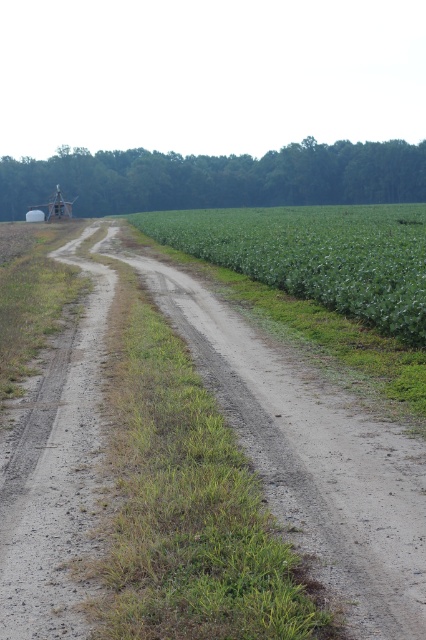
Who is more forward, (238,328) or (166,218)?

Point (238,328)

Who is taller, dusty gravel road at center or green leafy corn field at center?

Standing taller between the two is green leafy corn field at center.

Which is behind, point (359, 595) or point (226, 248)?

The point (226, 248) is more distant.

Find the location of a particular element. The height and width of the screenshot is (640, 426). dusty gravel road at center is located at coordinates (311, 458).